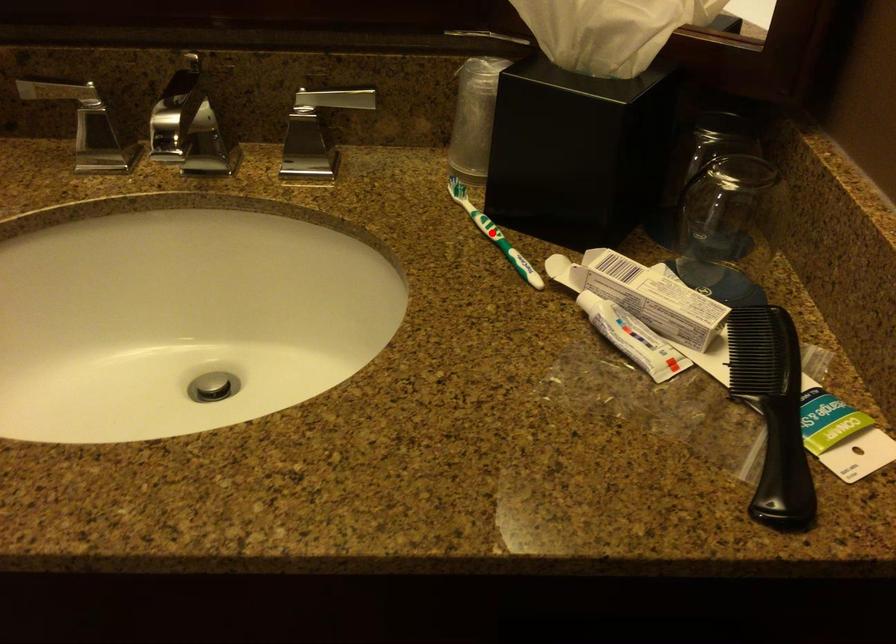
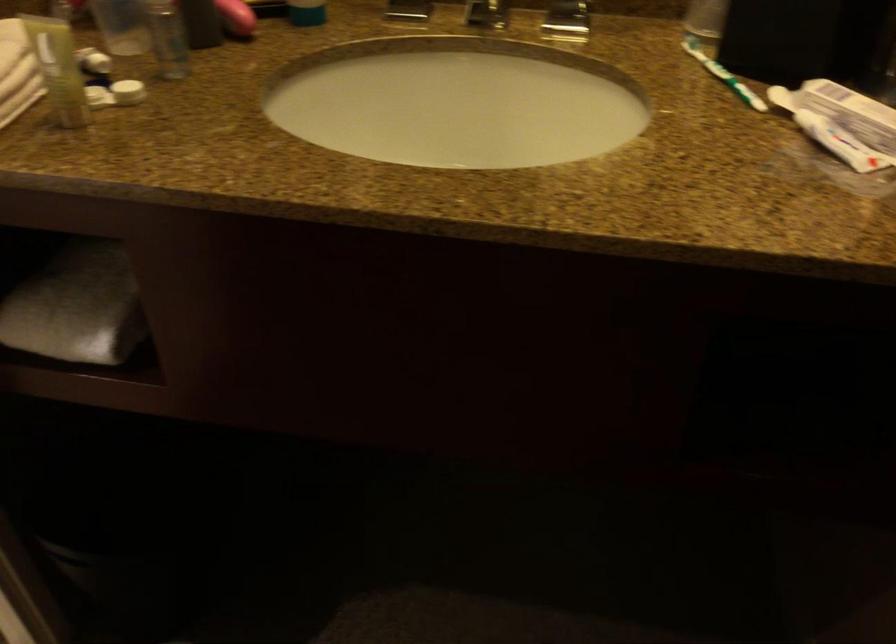
Find the pixel in the second image that matches the highlighted location in the first image.

(722, 75)